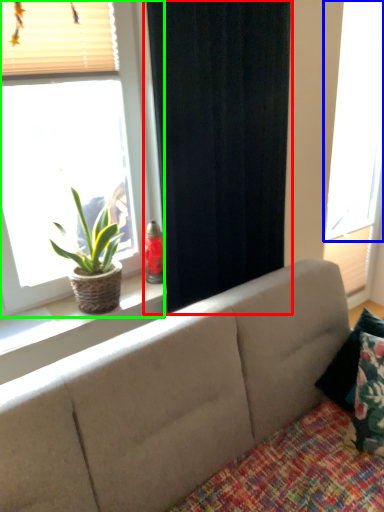
Question: Considering the real-world distances, which object is farthest from curtain (highlighted by a red box)? window (highlighted by a blue box) or window (highlighted by a green box)?

Choices:
 (A) window
 (B) window

Answer: (A)